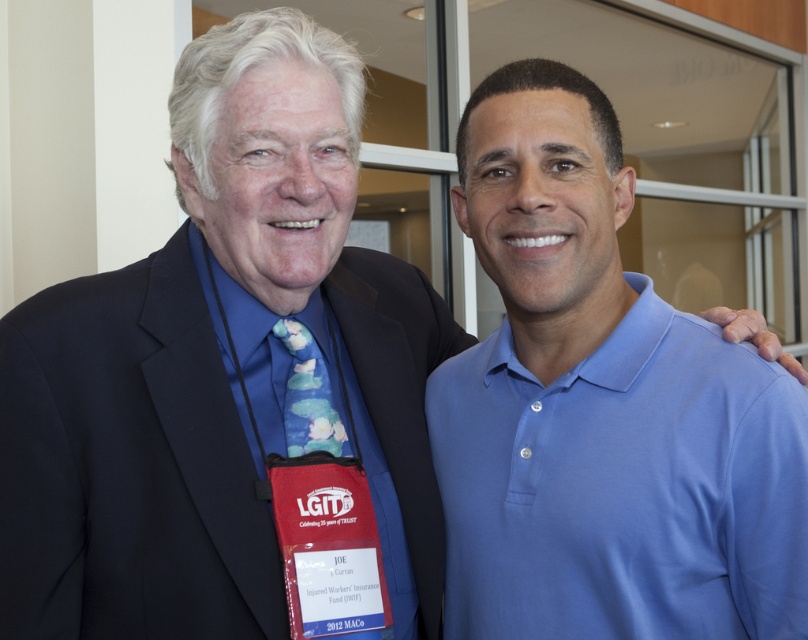
Is blue cotton shirt at left smaller than blue floral tie at center?

Incorrect, blue cotton shirt at left is not smaller in size than blue floral tie at center.

Who is positioned more to the right, blue cotton shirt at left or blue floral tie at center?

Positioned to the right is blue cotton shirt at left.

Image resolution: width=808 pixels, height=640 pixels. What are the coordinates of `blue cotton shirt at left` in the screenshot? It's located at (285, 371).

How distant is blue smooth polo shirt at right from blue floral tie at center?

blue smooth polo shirt at right is 30.41 centimeters from blue floral tie at center.

Does blue smooth polo shirt at right have a greater height compared to blue floral tie at center?

Correct, blue smooth polo shirt at right is much taller as blue floral tie at center.

Is point (634, 333) positioned before point (335, 413)?

Yes.

Where is `blue smooth polo shirt at right`? This screenshot has width=808, height=640. blue smooth polo shirt at right is located at coordinates (623, 486).

Does dark blue fabric business suit at left have a lesser width compared to blue floral tie at center?

No, dark blue fabric business suit at left is not thinner than blue floral tie at center.

Does point (135, 625) lie behind point (310, 380)?

No, (135, 625) is in front of (310, 380).

Is point (53, 483) positioned behind point (314, 429)?

No, (53, 483) is in front of (314, 429).

Where is `dark blue fabric business suit at left`? dark blue fabric business suit at left is located at coordinates (125, 467).